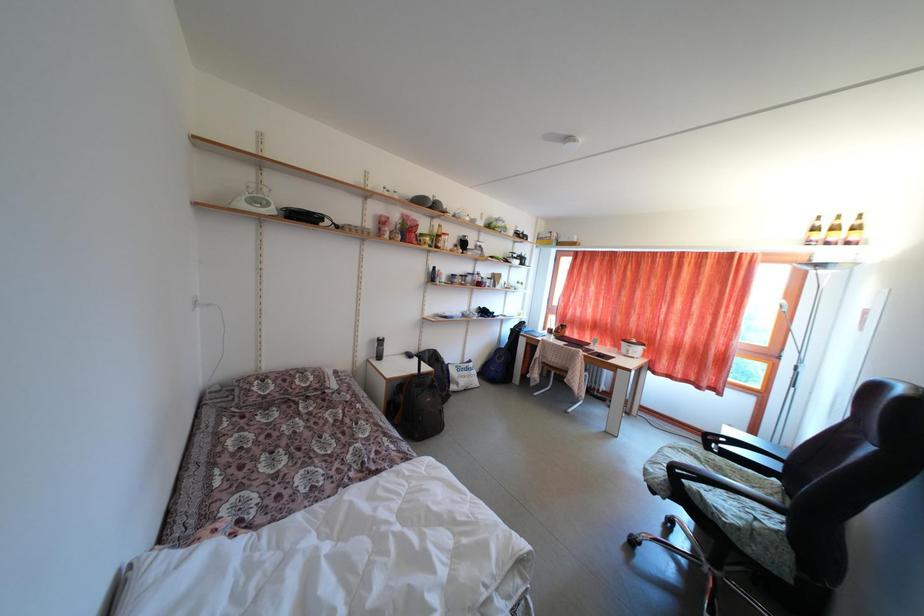
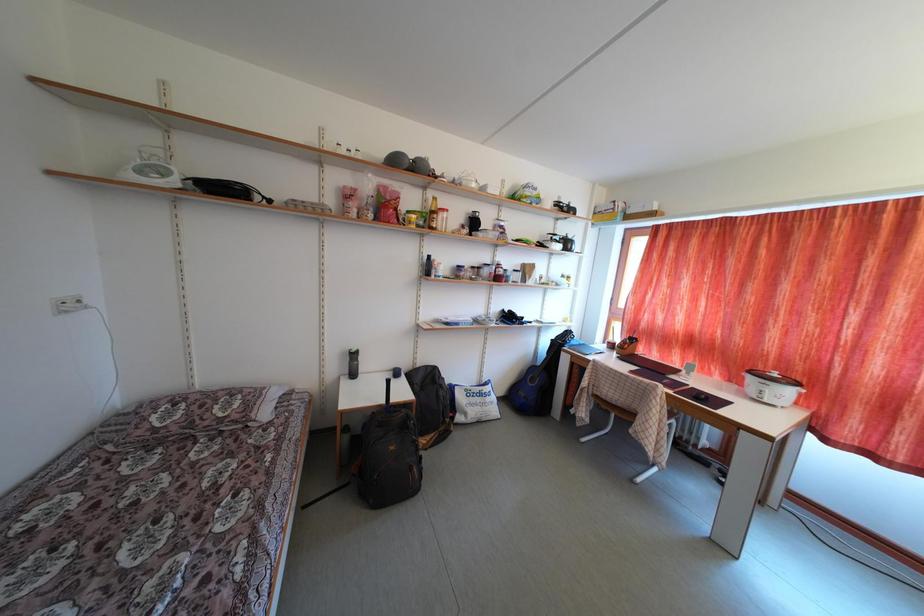
The images are taken continuously from a first-person perspective. In which direction are you moving?

The cameraman walked toward right, forward.